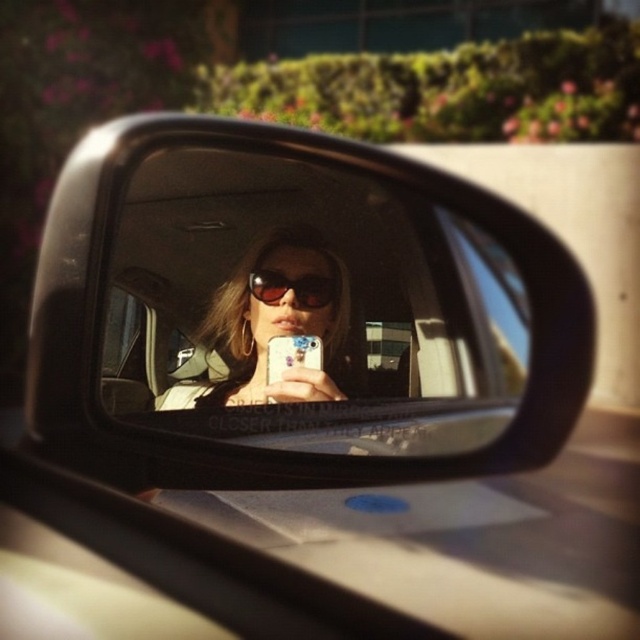
Question: Does matte black sunglasses at center appear over sunglasses at center?

Choices:
 (A) yes
 (B) no

Answer: (B)

Question: Is matte plastic mirror at center smaller than matte black sunglasses at center?

Choices:
 (A) yes
 (B) no

Answer: (B)

Question: Which object is positioned closest to the matte black sunglasses at center?

Choices:
 (A) sunglasses at center
 (B) matte plastic mirror at center

Answer: (B)

Question: Which of these objects is positioned closest to the sunglasses at center?

Choices:
 (A) matte black sunglasses at center
 (B) matte plastic mirror at center

Answer: (A)

Question: From the image, what is the correct spatial relationship of matte plastic mirror at center in relation to matte black sunglasses at center?

Choices:
 (A) below
 (B) above

Answer: (B)

Question: Estimate the real-world distances between objects in this image. Which object is closer to the sunglasses at center?

Choices:
 (A) matte black sunglasses at center
 (B) matte plastic mirror at center

Answer: (A)